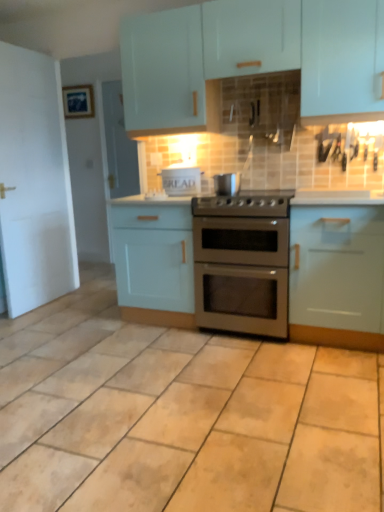
Question: From the image's perspective, is satin silver pot at center, placed as the first appliance when sorted from right to left, located beneath matte white cabinets at upper center, placed as the third cabinetry when sorted from bottom to top?

Choices:
 (A) no
 (B) yes

Answer: (B)

Question: Would you say satin silver pot at center, the 2th appliance when ordered from left to right, is outside matte white cabinets at upper center, placed as the third cabinetry when sorted from bottom to top?

Choices:
 (A) yes
 (B) no

Answer: (A)

Question: From a real-world perspective, is satin silver pot at center, which is the second appliance in back-to-front order, positioned over matte white cabinets at upper center, placed as the 1th cabinetry when sorted from top to bottom, based on gravity?

Choices:
 (A) yes
 (B) no

Answer: (B)

Question: Is satin silver pot at center, placed as the first appliance when sorted from right to left, shorter than matte white cabinets at upper center, placed as the 1th cabinetry when sorted from top to bottom?

Choices:
 (A) no
 (B) yes

Answer: (B)

Question: Can you confirm if satin silver pot at center, the 2th appliance when ordered from left to right, is bigger than matte white cabinets at upper center, placed as the third cabinetry when sorted from bottom to top?

Choices:
 (A) yes
 (B) no

Answer: (B)

Question: From the image's perspective, is stainless steel gas stove at center positioned above or below matte blue picture frame at upper left?

Choices:
 (A) above
 (B) below

Answer: (B)

Question: In terms of height, does stainless steel gas stove at center look taller or shorter compared to matte blue picture frame at upper left?

Choices:
 (A) tall
 (B) short

Answer: (B)

Question: Looking at their shapes, would you say stainless steel gas stove at center is wider or thinner than matte blue picture frame at upper left?

Choices:
 (A) wide
 (B) thin

Answer: (A)

Question: Choose the correct answer: Is stainless steel gas stove at center inside matte blue picture frame at upper left or outside it?

Choices:
 (A) outside
 (B) inside

Answer: (A)

Question: Choose the correct answer: Is white cardboard bread box at center, which ranks as the first appliance in back-to-front order, inside satin silver pot at center, marked as the 1th appliance in a front-to-back arrangement, or outside it?

Choices:
 (A) outside
 (B) inside

Answer: (A)

Question: Visually, is white cardboard bread box at center, acting as the 2th appliance starting from the front, positioned to the left or to the right of satin silver pot at center, placed as the first appliance when sorted from right to left?

Choices:
 (A) right
 (B) left

Answer: (B)

Question: Is point (177, 195) positioned closer to the camera than point (226, 186)?

Choices:
 (A) farther
 (B) closer

Answer: (A)

Question: In terms of size, does white cardboard bread box at center, which ranks as the first appliance in back-to-front order, appear bigger or smaller than satin silver pot at center, placed as the first appliance when sorted from right to left?

Choices:
 (A) small
 (B) big

Answer: (B)

Question: Considering the positions of point (177, 267) and point (350, 49), is point (177, 267) closer or farther from the camera than point (350, 49)?

Choices:
 (A) closer
 (B) farther

Answer: (B)

Question: Considering the positions of matte light blue cabinet at center, the 2th cabinetry viewed from the top, and matte white cabinets at upper center, placed as the 1th cabinetry when sorted from top to bottom, in the image, is matte light blue cabinet at center, the 2th cabinetry viewed from the top, bigger or smaller than matte white cabinets at upper center, placed as the 1th cabinetry when sorted from top to bottom,?

Choices:
 (A) small
 (B) big

Answer: (A)